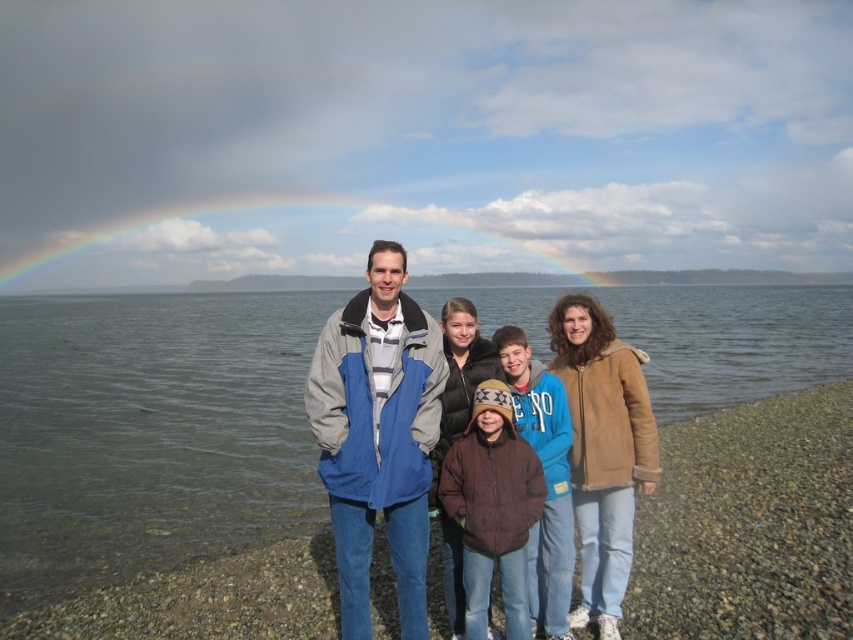
Question: Which point is closer to the camera taking this photo?

Choices:
 (A) (358, 305)
 (B) (488, 577)
 (C) (563, 244)
 (D) (404, 396)

Answer: (B)

Question: Can you confirm if blue and gray jacket at center is thinner than rainbow at upper center?

Choices:
 (A) yes
 (B) no

Answer: (A)

Question: Does clear water at center have a greater width compared to brown fuzzy jacket at center?

Choices:
 (A) no
 (B) yes

Answer: (B)

Question: Among these points, which one is farthest from the camera?

Choices:
 (A) (560, 221)
 (B) (409, 449)
 (C) (508, 426)

Answer: (A)

Question: Which of the following is the farthest from the observer?

Choices:
 (A) blue fleece jacket at center
 (B) brown fuzzy jacket at center
 (C) blue and gray jacket at center

Answer: (A)

Question: Does clear water at center appear on the right side of rainbow at upper center?

Choices:
 (A) yes
 (B) no

Answer: (A)